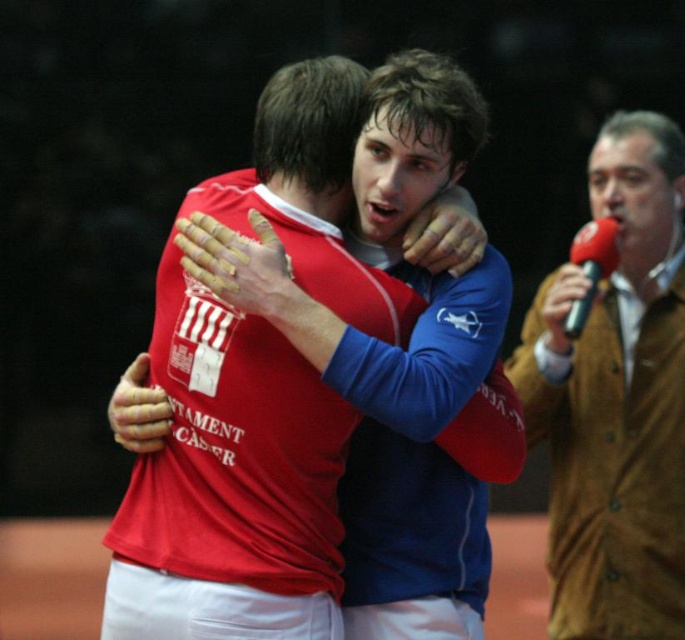
Question: In this image, where is matte red jersey at center located relative to black plastic microphone at right?

Choices:
 (A) above
 (B) below

Answer: (B)

Question: Among these objects, which one is nearest to the camera?

Choices:
 (A) brown corduroy blazer at right
 (B) matte red jersey at center
 (C) black plastic microphone at right

Answer: (B)

Question: Considering the relative positions of matte red jersey at center and brown corduroy blazer at right in the image provided, where is matte red jersey at center located with respect to brown corduroy blazer at right?

Choices:
 (A) below
 (B) above

Answer: (B)

Question: Is brown corduroy blazer at right smaller than black plastic microphone at right?

Choices:
 (A) no
 (B) yes

Answer: (A)

Question: Which point is closer to the camera?

Choices:
 (A) black plastic microphone at right
 (B) brown corduroy blazer at right
 (C) matte red jersey at center

Answer: (C)

Question: Which point is closer to the camera?

Choices:
 (A) (580, 321)
 (B) (314, 488)

Answer: (B)